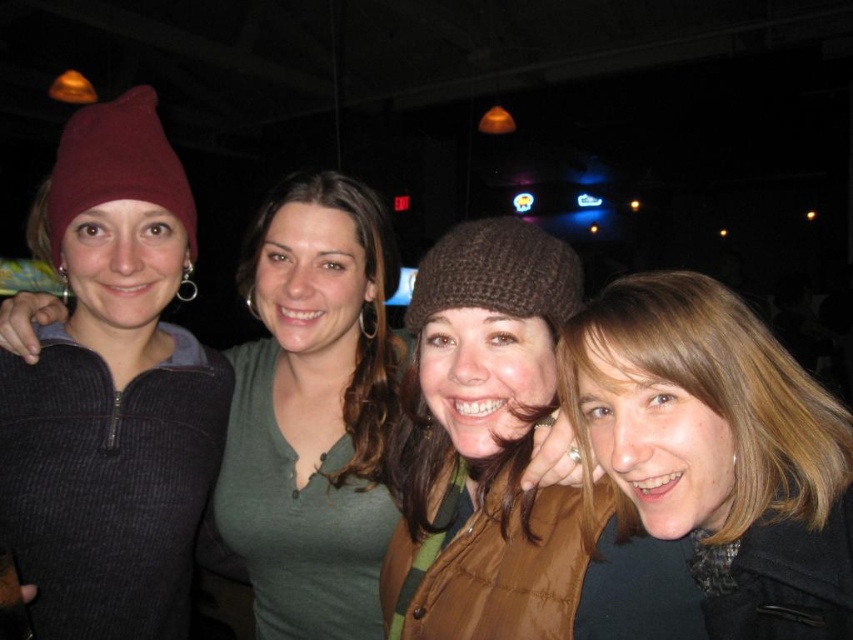
Question: Is matte dark gray sweater at left to the left of knitted brown hat at center from the viewer's perspective?

Choices:
 (A) no
 (B) yes

Answer: (B)

Question: Estimate the real-world distances between objects in this image. Which object is farther from the matte dark gray sweater at left?

Choices:
 (A) maroon knit beanie at left
 (B) blonde hair at center
 (C) knitted brown hat at center

Answer: (B)

Question: Is matte dark gray sweater at left further to the viewer compared to knitted brown hat at center?

Choices:
 (A) yes
 (B) no

Answer: (A)

Question: Among these points, which one is nearest to the camera?

Choices:
 (A) (160, 504)
 (B) (64, 186)

Answer: (B)

Question: Among these objects, which one is farthest from the camera?

Choices:
 (A) matte dark gray sweater at left
 (B) blonde hair at center

Answer: (A)

Question: Is blonde hair at center closer to the viewer compared to maroon knit beanie at left?

Choices:
 (A) yes
 (B) no

Answer: (A)